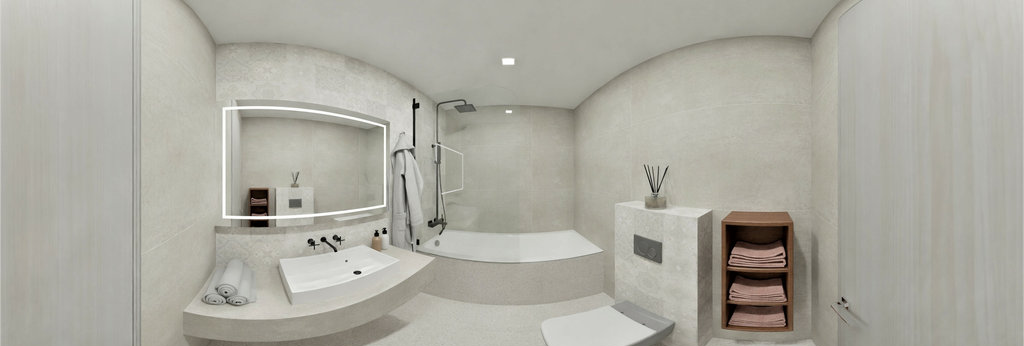
Identify the location of bathtub. Image resolution: width=1024 pixels, height=346 pixels. (534, 250).